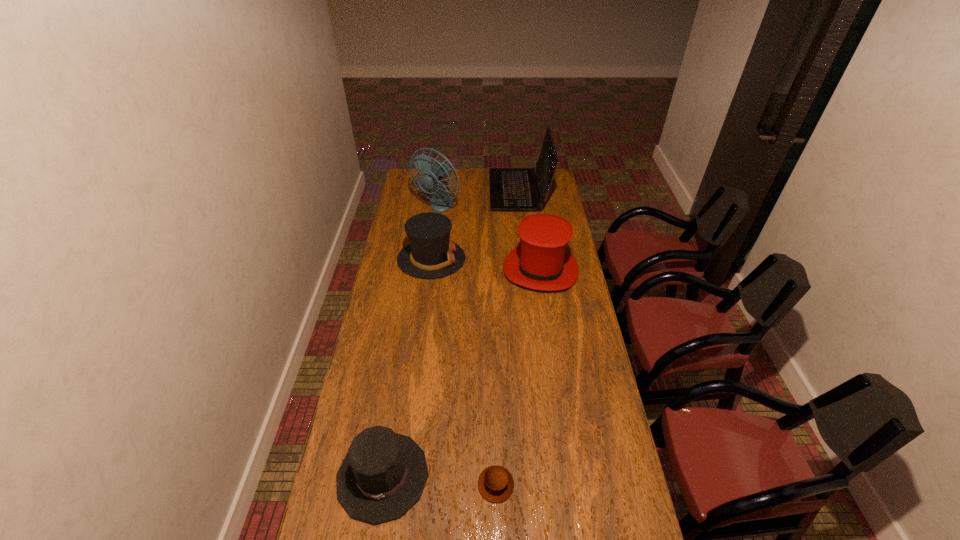
Locate an element on the screen. free location located 0.130m on the screen of the second tallest object is located at coordinates (468, 191).

Find the location of `vacant space located on the front of the tallest dress hat`. vacant space located on the front of the tallest dress hat is located at coordinates (551, 340).

This screenshot has width=960, height=540. I want to click on vacant space located on the back of the muffin, so click(x=494, y=436).

Where is `object positioned at the far edge`? The width and height of the screenshot is (960, 540). object positioned at the far edge is located at coordinates (511, 189).

This screenshot has width=960, height=540. In order to click on fan positioned at the left edge in this screenshot , I will do `click(441, 201)`.

You are a GUI agent. You are given a task and a screenshot of the screen. Output one action in this format:
    pyautogui.click(x=<x>, y=<y>)
    Task: Click on the laptop computer present at the right edge
    This screenshot has height=540, width=960.
    Given the screenshot: What is the action you would take?
    pyautogui.click(x=511, y=189)

Locate an element on the screen. The height and width of the screenshot is (540, 960). hat positioned at the right edge is located at coordinates (541, 262).

The image size is (960, 540). Identify the location of object located at the far right corner. (511, 189).

Where is `vacant area at the far edge of the desktop`? This screenshot has height=540, width=960. vacant area at the far edge of the desktop is located at coordinates (478, 168).

The width and height of the screenshot is (960, 540). In order to click on vacant area at the left edge in this screenshot , I will do `click(364, 368)`.